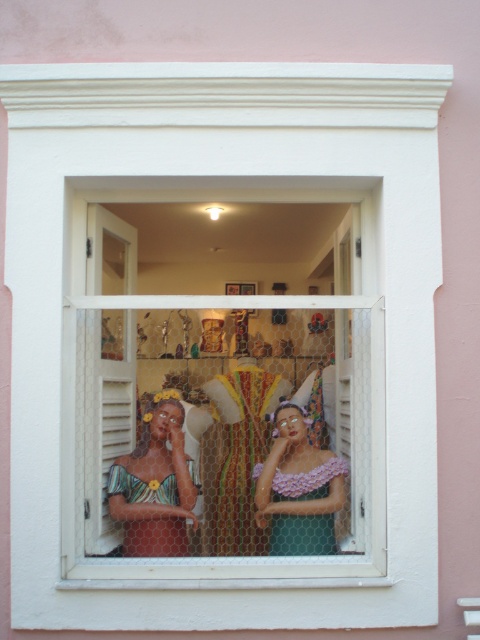
Question: Does multicolored fabric dress at center appear over matte green dress at center?

Choices:
 (A) yes
 (B) no

Answer: (A)

Question: Can you confirm if multicolored fabric dress at center is wider than matte green dress at center?

Choices:
 (A) yes
 (B) no

Answer: (B)

Question: Which point is closer to the camera?

Choices:
 (A) multicolored fabric dress at center
 (B) matte green dress at center

Answer: (A)

Question: Among these objects, which one is farthest from the camera?

Choices:
 (A) multicolored fabric dress at center
 (B) matte green dress at center

Answer: (B)

Question: Can you confirm if transparent plastic dolls at center is bigger than multicolored fabric dress at center?

Choices:
 (A) no
 (B) yes

Answer: (B)

Question: Considering the real-world distances, which object is farthest from the transparent plastic dolls at center?

Choices:
 (A) matte green dress at center
 (B) multicolored fabric dress at center

Answer: (A)